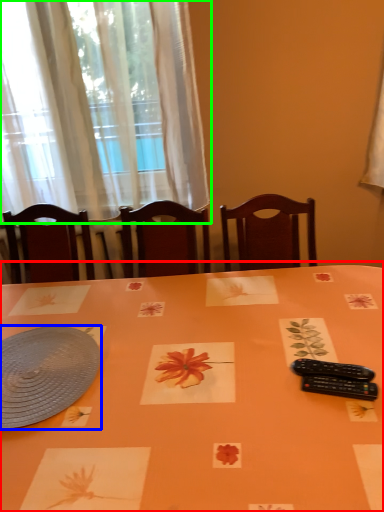
Question: Estimate the real-world distances between objects in this image. Which object is farther from table (highlighted by a red box), platter (highlighted by a blue box) or curtain (highlighted by a green box)?

Choices:
 (A) platter
 (B) curtain

Answer: (B)